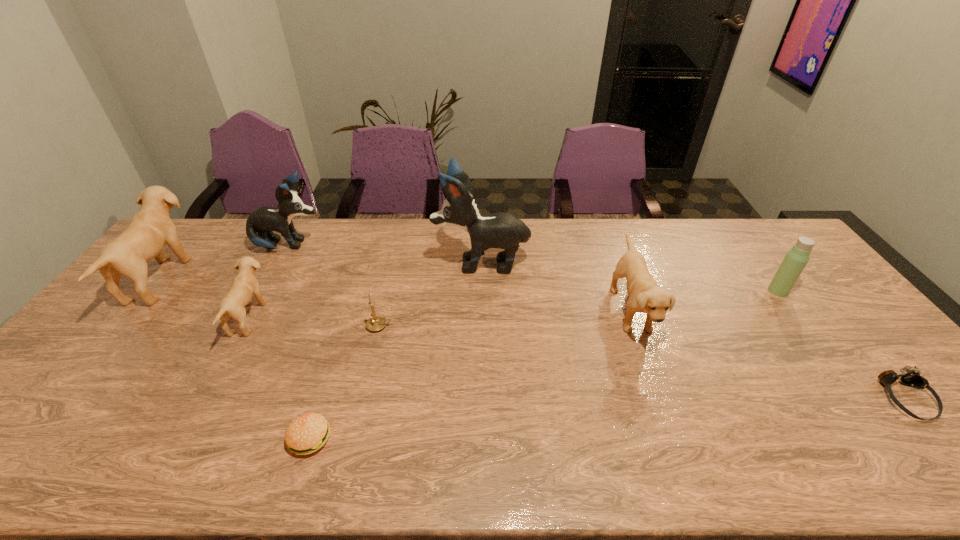
Identify the location of object that is the closest to the brown patty. (376, 323).

Point out which object is positioned as the third nearest to the rightmost object. Please provide its 2D coordinates. Your answer should be formatted as a tuple, i.e. [(x, y)], where the tuple contains the x and y coordinates of a point satisfying the conditions above.

[(501, 230)]

Find the location of a particular element. The width and height of the screenshot is (960, 540). the third closest puppy to the smaller black puppy is located at coordinates (501, 230).

Identify which puppy is located as the fourth nearest to the second beige puppy from right to left. Please provide its 2D coordinates. Your answer should be formatted as a tuple, i.e. [(x, y)], where the tuple contains the x and y coordinates of a point satisfying the conditions above.

[(645, 296)]

Locate which beige puppy is the closest to the smallest beige puppy. Please provide its 2D coordinates. Your answer should be formatted as a tuple, i.e. [(x, y)], where the tuple contains the x and y coordinates of a point satisfying the conditions above.

[(151, 228)]

You are a GUI agent. You are given a task and a screenshot of the screen. Output one action in this format:
    pyautogui.click(x=<x>, y=<y>)
    Task: Click on the beige puppy that can be found as the closest to the bronze goggles
    
    Given the screenshot: What is the action you would take?
    [645, 296]

Locate an element on the screen. vacant space that satisfies the following two spatial constraints: 1. on the front-facing side of the right black puppy; 2. on the front side of the sixth object from right to left is located at coordinates (482, 438).

Where is `free space that satisfies the following two spatial constraints: 1. on the front-facing side of the fourth object from right to left; 2. on the left side of the thermos bottle`? This screenshot has height=540, width=960. free space that satisfies the following two spatial constraints: 1. on the front-facing side of the fourth object from right to left; 2. on the left side of the thermos bottle is located at coordinates (481, 291).